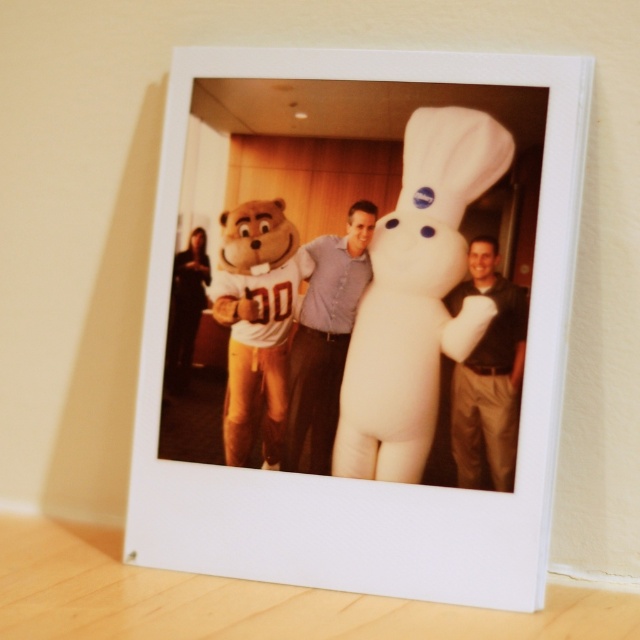
Question: Which point appears closest to the camera in this image?

Choices:
 (A) [x=230, y=413]
 (B) [x=323, y=310]

Answer: (A)

Question: Does white plush at center appear on the left side of matte blue shirt at center?

Choices:
 (A) yes
 (B) no

Answer: (B)

Question: Is orange plush teddy bear at center bigger than dark brown leather jacket at center?

Choices:
 (A) no
 (B) yes

Answer: (B)

Question: Is white matte photo frame at center closer to camera compared to dark brown leather jacket at center?

Choices:
 (A) no
 (B) yes

Answer: (B)

Question: Among these objects, which one is farthest from the camera?

Choices:
 (A) matte blue shirt at center
 (B) dark brown leather jacket at center
 (C) white plush at center

Answer: (A)

Question: Which object is positioned farthest from the white plush at center?

Choices:
 (A) matte blue shirt at center
 (B) dark brown leather jacket at center

Answer: (A)